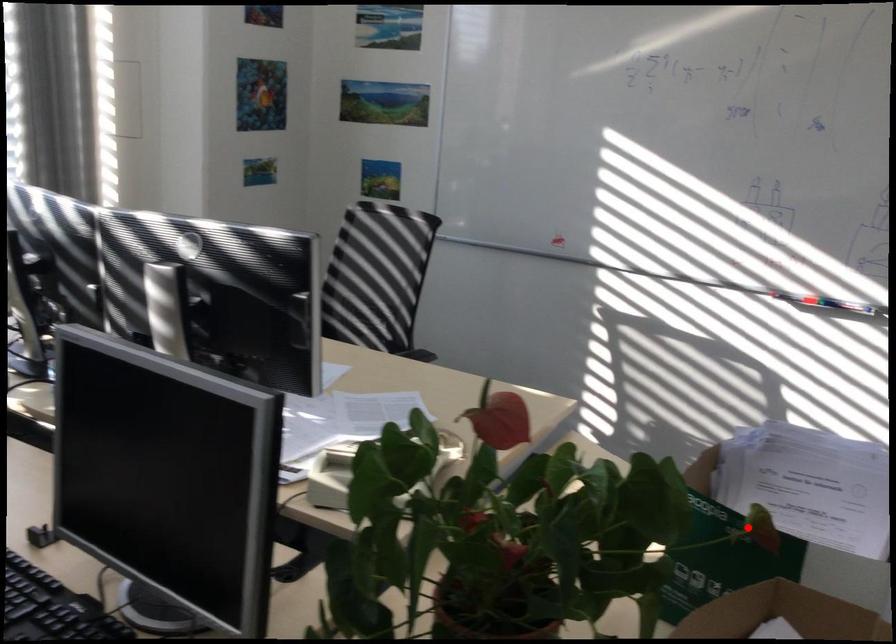
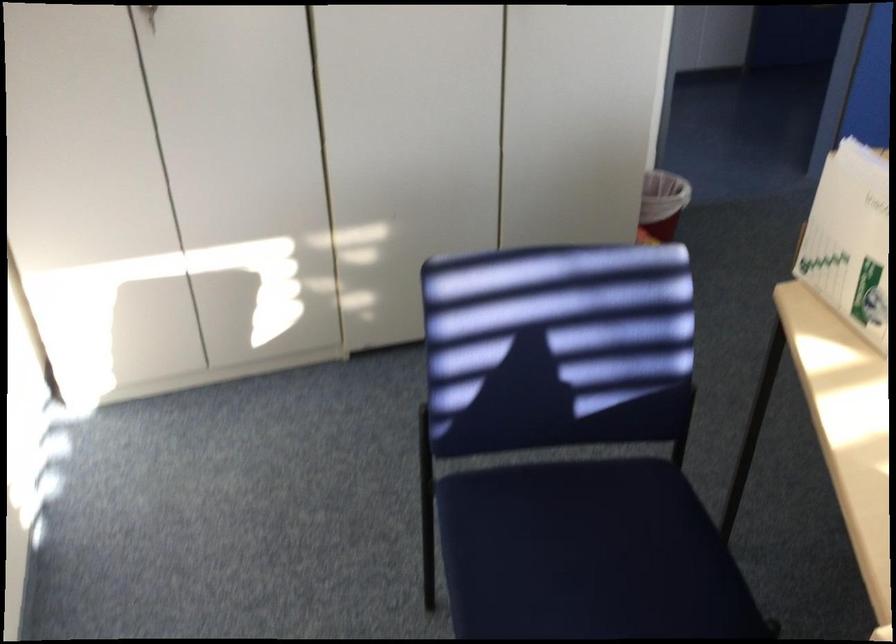
Question: I am providing you with two images of the same scene from different viewpoints. Given a red point in image1, look at the same physical point in image2. Is it:

Choices:
 (A) Closer to the viewpoint
 (B) Farther from the viewpoint

Answer: (B)